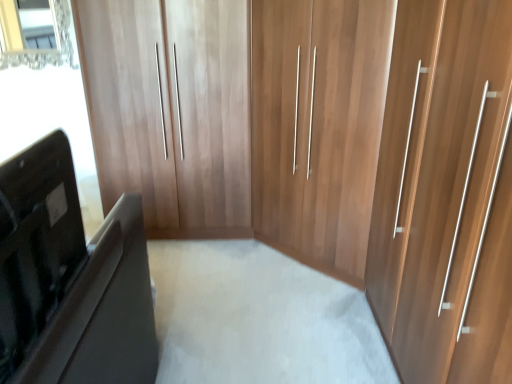
Question: Considering the relative positions of clear glass mirror at upper left and matte black laptop at left in the image provided, is clear glass mirror at upper left to the left of matte black laptop at left from the viewer's perspective?

Choices:
 (A) no
 (B) yes

Answer: (B)

Question: Is clear glass mirror at upper left smaller than matte black laptop at left?

Choices:
 (A) no
 (B) yes

Answer: (B)

Question: Is clear glass mirror at upper left looking in the opposite direction of matte black laptop at left?

Choices:
 (A) no
 (B) yes

Answer: (A)

Question: Is clear glass mirror at upper left wider than matte black laptop at left?

Choices:
 (A) no
 (B) yes

Answer: (A)

Question: From the image's perspective, is clear glass mirror at upper left above matte black laptop at left?

Choices:
 (A) no
 (B) yes

Answer: (B)

Question: From a real-world perspective, is clear glass mirror at upper left under matte black laptop at left?

Choices:
 (A) yes
 (B) no

Answer: (B)

Question: Considering the relative positions of matte black laptop at left and clear glass mirror at upper left in the image provided, is matte black laptop at left behind clear glass mirror at upper left?

Choices:
 (A) no
 (B) yes

Answer: (A)

Question: Is matte black laptop at left bigger than clear glass mirror at upper left?

Choices:
 (A) yes
 (B) no

Answer: (A)

Question: Is matte black laptop at left positioned before clear glass mirror at upper left?

Choices:
 (A) yes
 (B) no

Answer: (A)

Question: Can you confirm if matte black laptop at left is smaller than clear glass mirror at upper left?

Choices:
 (A) no
 (B) yes

Answer: (A)

Question: Can you confirm if matte black laptop at left is wider than clear glass mirror at upper left?

Choices:
 (A) yes
 (B) no

Answer: (A)

Question: Does matte black laptop at left appear on the right side of clear glass mirror at upper left?

Choices:
 (A) no
 (B) yes

Answer: (B)

Question: Considering the positions of matte black laptop at left and clear glass mirror at upper left in the image, is matte black laptop at left bigger or smaller than clear glass mirror at upper left?

Choices:
 (A) big
 (B) small

Answer: (A)